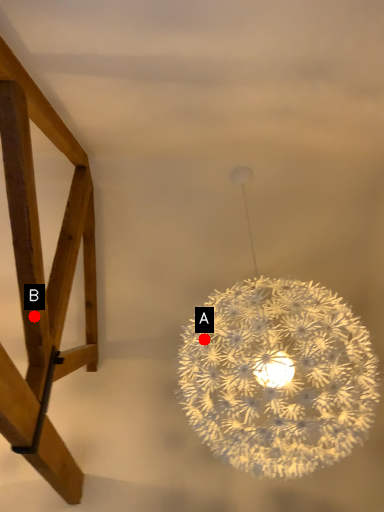
Question: Two points are circled on the image, labeled by A and B beside each circle. Which of the following is the farthest from the observer?

Choices:
 (A) A is further
 (B) B is further

Answer: (A)